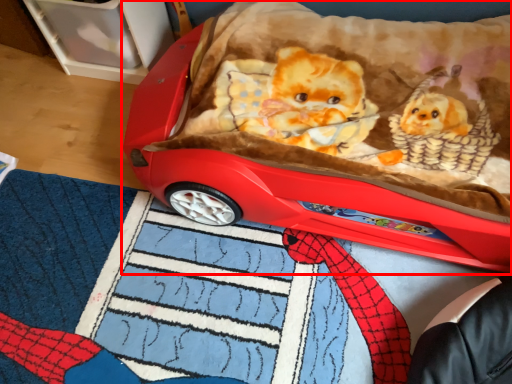
Question: Observing the image, what is the correct spatial positioning of toy (annotated by the red box) in reference to mat?

Choices:
 (A) right
 (B) left

Answer: (A)